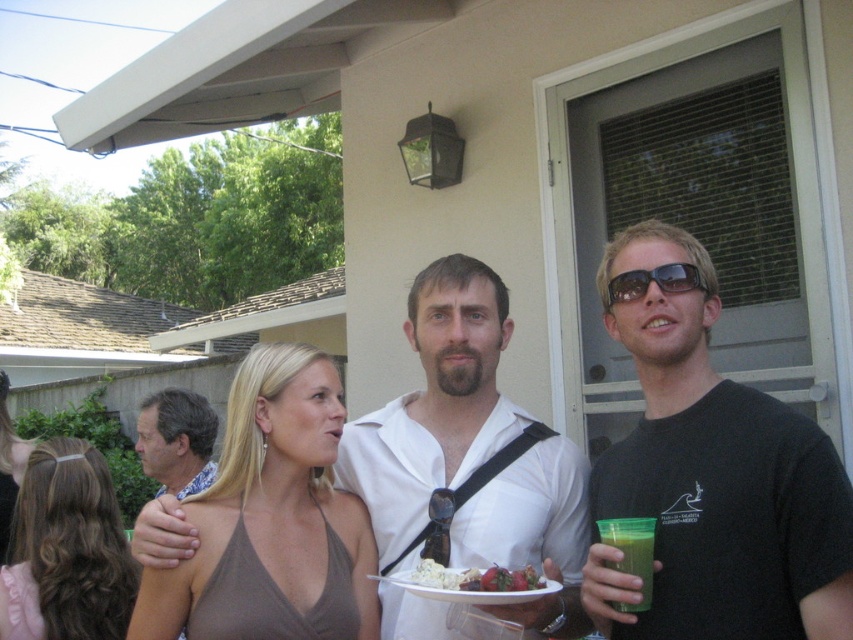
In the scene shown: You are planning to take a photo of the brown hair at center and the green translucent cup at right. Based on their positions, which object should you focus on first to ensure both are in frame?

The brown hair at center is taller than the green translucent cup at right, so you should focus on the brown hair at center first to ensure both are in frame.